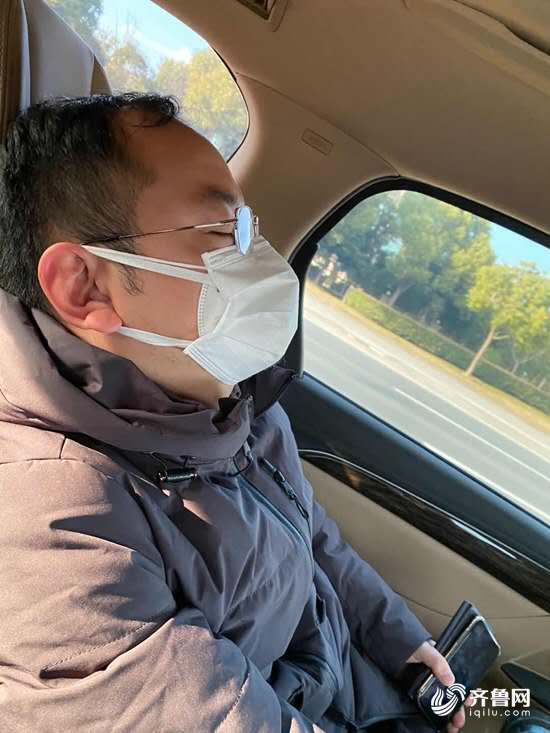
The width and height of the screenshot is (550, 733). In order to click on coat in this screenshot , I will do `click(222, 519)`.